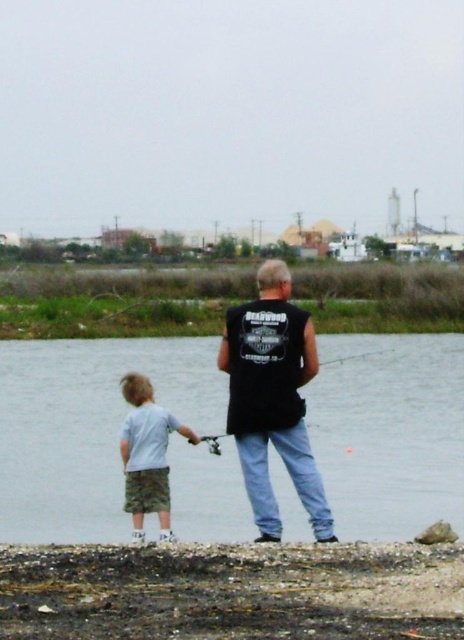
You are a photographer trying to capture a clear shot of the light gray cotton shirt at lower left and the matte black fishing pole at center. Which object should you focus on first if you want to ensure both are in focus without moving the camera?

The light gray cotton shirt at lower left is located below the matte black fishing pole at center. Since the shirt is closer to the camera, you should focus on the light gray cotton shirt at lower left first to ensure both are in focus.

You are a photographer trying to capture a photo of the clear water at center and the light gray cotton shirt at lower left. Which object is located higher in the image?

The clear water at center is positioned over the light gray cotton shirt at lower left, so it is higher in the image.

You are a photographer trying to capture the scene of the two fishermen. You want to focus on the light gray cotton shirt at lower left and the matte black fishing pole at center. Which object should you adjust your camera focus on first if you want to ensure both are in focus?

The light gray cotton shirt at lower left is closer to the viewer than the matte black fishing pole at center, so you should focus on the light gray cotton shirt at lower left first to ensure both are in focus.